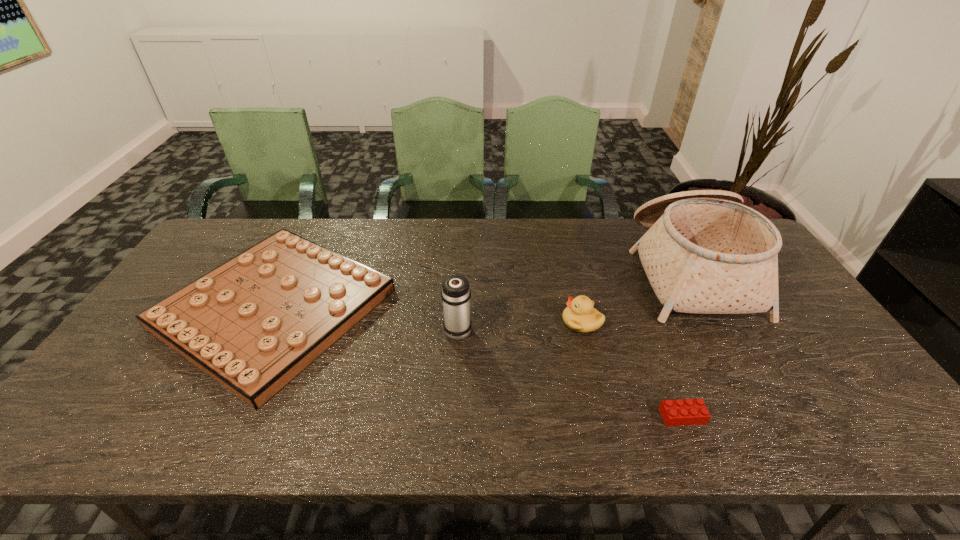
In order to click on empty location between the fourth tallest object and the basket in this screenshot , I will do `click(482, 289)`.

Find the location of `free space that is in between the third shortest object and the tallest object`. free space that is in between the third shortest object and the tallest object is located at coordinates (636, 296).

The image size is (960, 540). In order to click on free area in between the gameboard and the basket in this screenshot , I will do pyautogui.click(x=482, y=289).

This screenshot has width=960, height=540. What are the coordinates of `free point between the Lego and the leftmost object` in the screenshot? It's located at (478, 362).

Find the location of a particular element. vacant area that lies between the leftmost object and the shortest object is located at coordinates (478, 362).

Where is `vacant space that is in between the Lego and the leftmost object`? Image resolution: width=960 pixels, height=540 pixels. vacant space that is in between the Lego and the leftmost object is located at coordinates (478, 362).

Find the location of a particular element. Image resolution: width=960 pixels, height=540 pixels. free space that is in between the Lego and the gameboard is located at coordinates (478, 362).

In order to click on empty space between the third object from right to left and the fourth shortest object in this screenshot , I will do `click(520, 326)`.

This screenshot has height=540, width=960. Find the location of `object that is the third nearest to the Lego`. object that is the third nearest to the Lego is located at coordinates (455, 293).

Choose which object is the second nearest neighbor to the fourth shortest object. Please provide its 2D coordinates. Your answer should be formatted as a tuple, i.e. [(x, y)], where the tuple contains the x and y coordinates of a point satisfying the conditions above.

[(580, 316)]